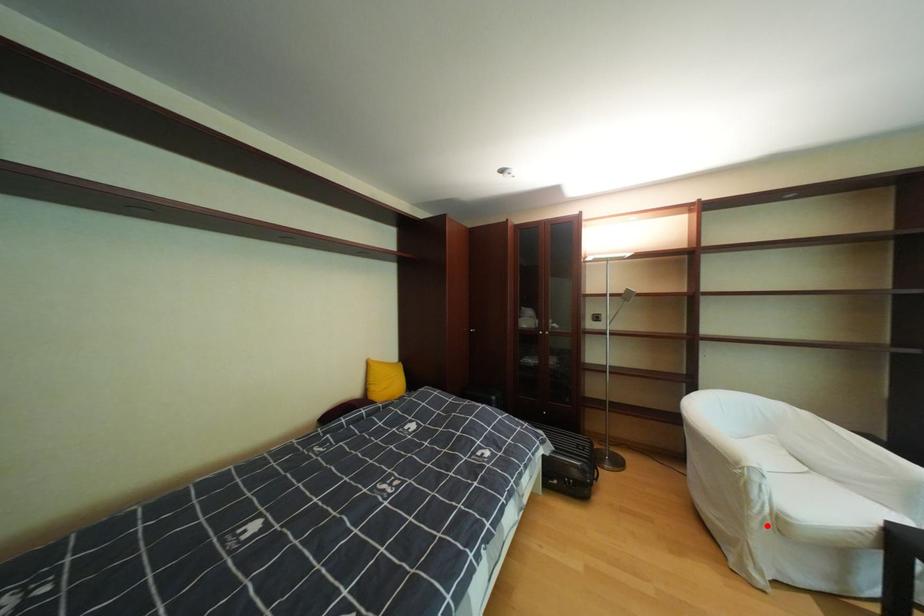
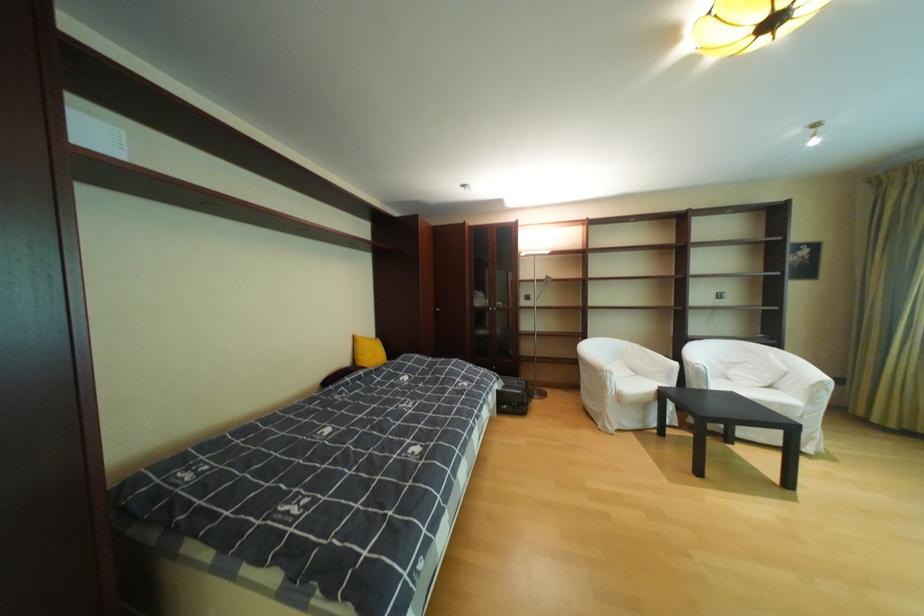
Where in the second image is the point corresponding to the highlighted location from the first image?

(621, 402)